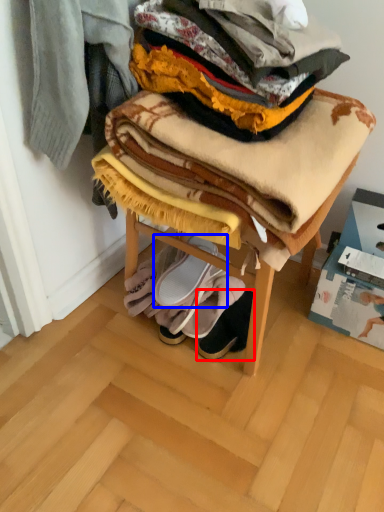
Question: Which point is closer to the camera, footwear (highlighted by a red box) or footwear (highlighted by a blue box)?

Choices:
 (A) footwear
 (B) footwear

Answer: (A)